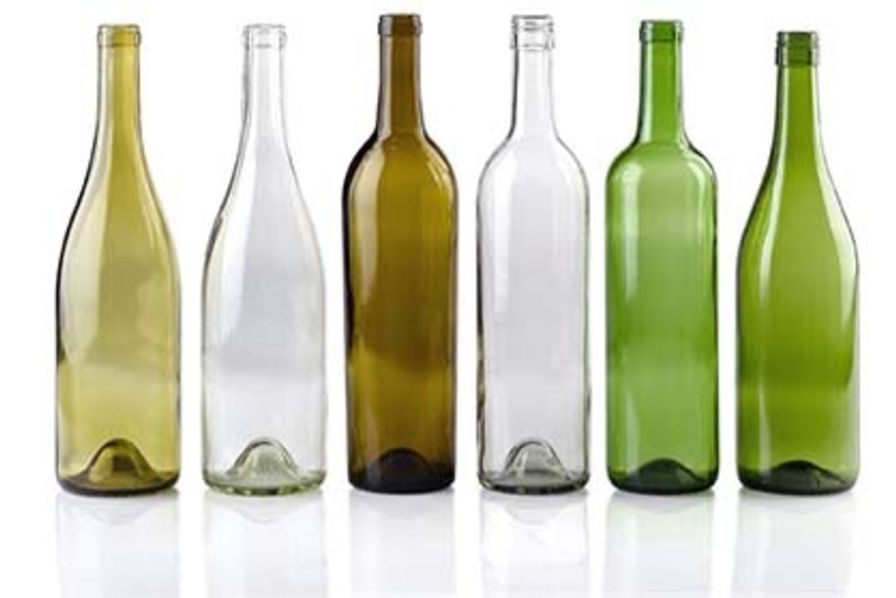
The height and width of the screenshot is (598, 896). What are the coordinates of `empty wine bottles` in the screenshot? It's located at (266, 377), (113, 358), (389, 371), (530, 370), (650, 393), (780, 408).